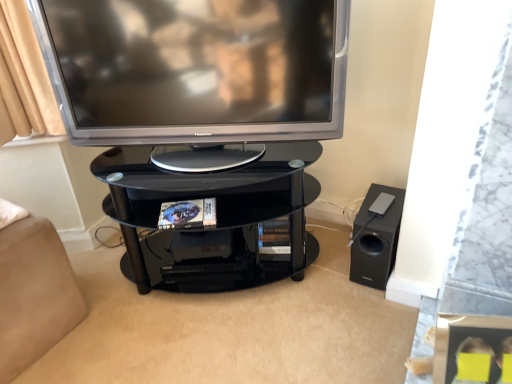
Where is `vacant space that is in between beige fabric bed at lower left and black glass shelf at center`? The height and width of the screenshot is (384, 512). vacant space that is in between beige fabric bed at lower left and black glass shelf at center is located at coordinates 135,307.